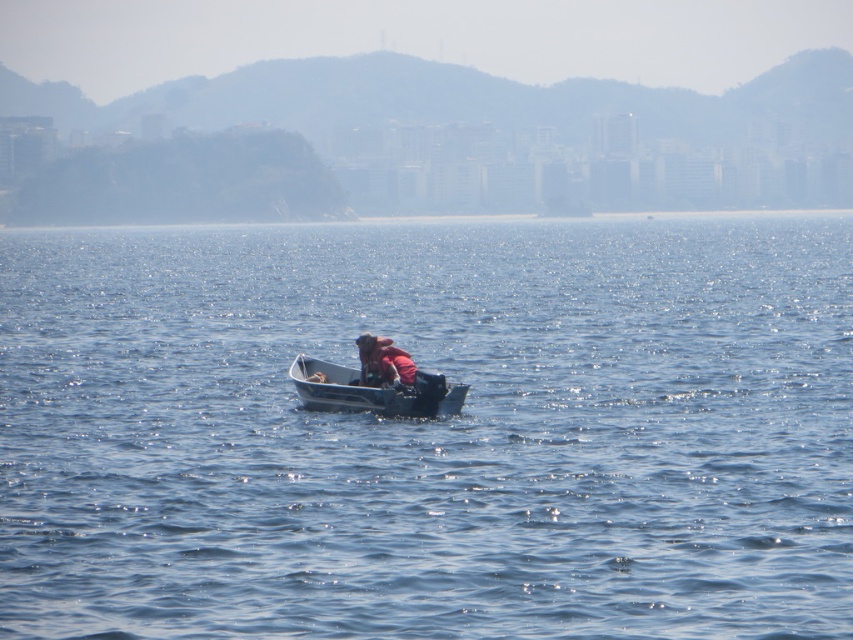
Question: Which point is closer to the camera taking this photo?

Choices:
 (A) (619, 598)
 (B) (418, 376)
 (C) (360, 356)

Answer: (A)

Question: Can you confirm if metallic gray canoe at center is positioned below pink fabric at center?

Choices:
 (A) yes
 (B) no

Answer: (A)

Question: Does metallic gray canoe at center have a greater width compared to pink fabric at center?

Choices:
 (A) yes
 (B) no

Answer: (A)

Question: Which object is positioned farthest from the blue water at center?

Choices:
 (A) metallic gray canoe at center
 (B) pink fabric at center

Answer: (A)

Question: Which object appears closest to the camera in this image?

Choices:
 (A) blue water at center
 (B) pink fabric at center

Answer: (A)

Question: Where is metallic gray canoe at center located in relation to pink fabric at center in the image?

Choices:
 (A) above
 (B) below

Answer: (B)